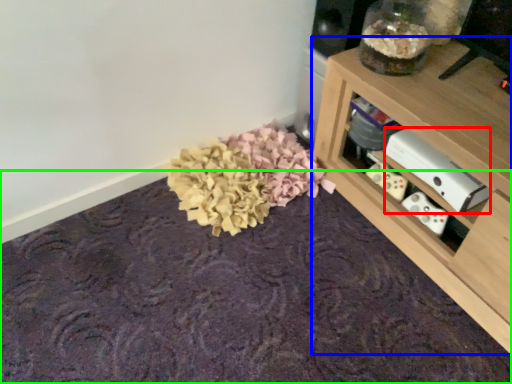
Question: Considering the real-world distances, which object is closest to appliance (highlighted by a red box)? shelf (highlighted by a blue box) or mat (highlighted by a green box).

Choices:
 (A) shelf
 (B) mat

Answer: (A)